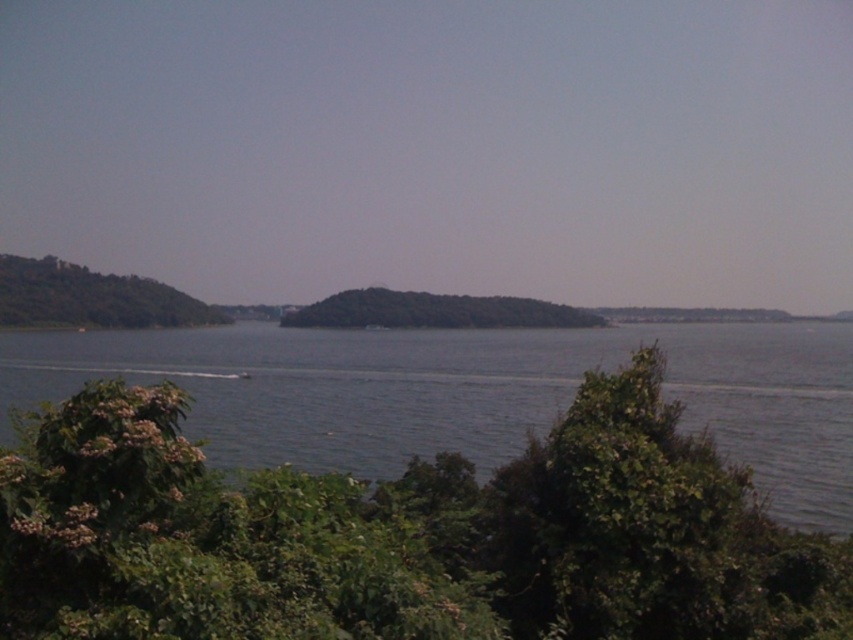
You are a photographer setting up a tripod to capture the small boat on the water. You want to ensure the green leafy bush at lower center and the green leafy hill at center are both in focus. Given that your camera can only focus on objects within a 1.5 meter height range, will both objects be in focus?

The green leafy bush at lower center is shorter than the green leafy hill at center. Since the height difference between them is more than 1.5 meters, the camera cannot focus on both objects simultaneously within the 1.5 meter height range.

You are standing at the edge of the lake and see a point marked at coordinates (402, 534). According to the scene description, what object is located at that point?

The green leafy bush at lower center is located at point (402, 534).

You are standing at the edge of the water and want to take a photo of both the green leafy tree at left and the green leafy hill at center. Which object should you frame first in your camera viewfinder to ensure both are in the shot?

You should frame the green leafy tree at left first because it is positioned above the green leafy hill at center, so adjusting the viewfinder to include the higher object first ensures the lower one will also be captured.